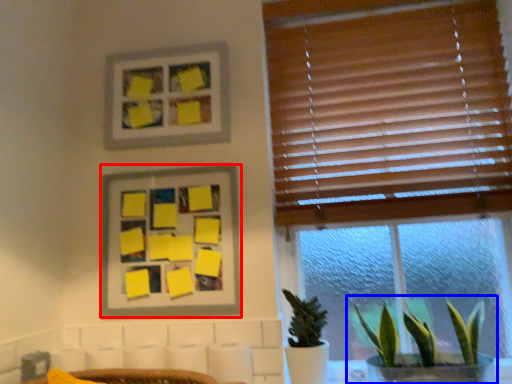
Question: Which of the following is the farthest to the observer, picture frame (highlighted by a red box) or houseplant (highlighted by a blue box)?

Choices:
 (A) picture frame
 (B) houseplant

Answer: (A)